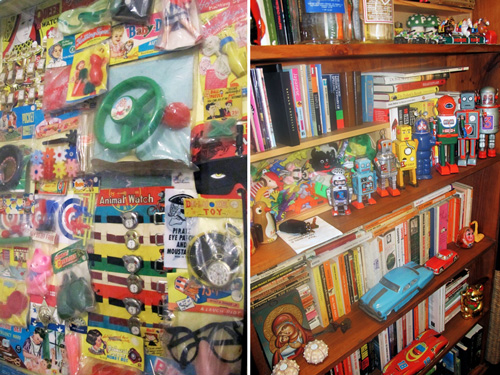
This screenshot has width=500, height=375. I want to click on toy robots, so click(x=372, y=177), click(x=404, y=151), click(x=474, y=115).